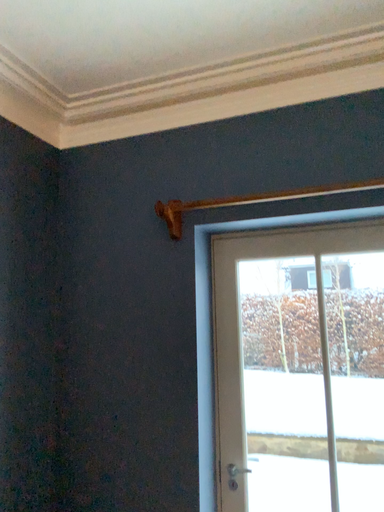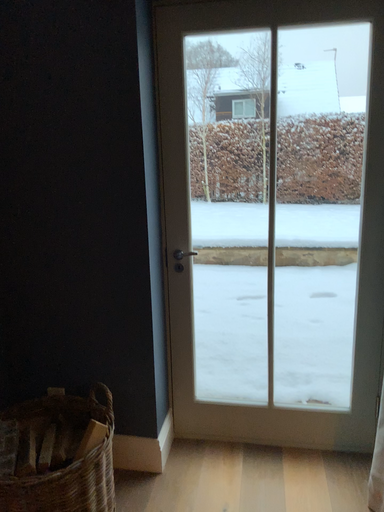
Question: How did the camera likely rotate when shooting the video?

Choices:
 (A) rotated right
 (B) rotated left

Answer: (A)